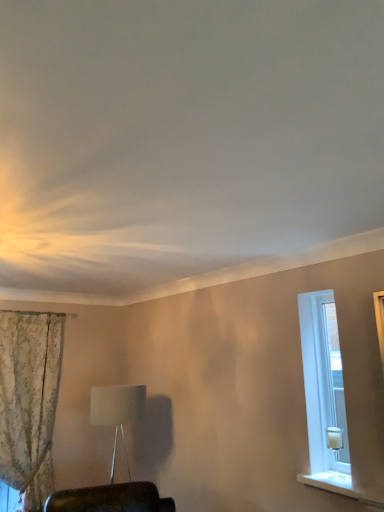
Identify the location of white fabric lampshade at center. (117, 412).

In the scene shown: Measure the distance between white smooth window sill at lower right and camera.

They are 1.97 meters apart.

The width and height of the screenshot is (384, 512). Describe the element at coordinates (343, 486) in the screenshot. I see `white smooth window sill at lower right` at that location.

What do you see at coordinates (324, 394) in the screenshot? I see `white glass candle at right` at bounding box center [324, 394].

Image resolution: width=384 pixels, height=512 pixels. I want to click on white fabric lampshade at center, so click(117, 412).

Is white smooth window sill at lower right aimed at floral fabric curtain at left?

No, white smooth window sill at lower right is not oriented towards floral fabric curtain at left.

The height and width of the screenshot is (512, 384). In order to click on curtain that appears behind the white smooth window sill at lower right in this screenshot , I will do `click(29, 400)`.

Between white smooth window sill at lower right and floral fabric curtain at left, which one is positioned behind?

floral fabric curtain at left is further away from the camera.

Would you say white smooth window sill at lower right is outside floral fabric curtain at left?

white smooth window sill at lower right is positioned outside floral fabric curtain at left.

From the picture: Is floral fabric curtain at left not within white fabric lampshade at center?

floral fabric curtain at left lies outside white fabric lampshade at center's area.

Does point (26, 345) come farther from viewer compared to point (120, 410)?

Yes, it is behind point (120, 410).

From their relative heights in the image, would you say floral fabric curtain at left is taller or shorter than white fabric lampshade at center?

Considering their sizes, floral fabric curtain at left has more height than white fabric lampshade at center.

From the image's perspective, relative to white glass candle at right, is floral fabric curtain at left above or below?

floral fabric curtain at left is situated lower than white glass candle at right in the image.

Measure the distance from floral fabric curtain at left to white glass candle at right.

They are 2.28 meters apart.

Is floral fabric curtain at left inside or outside of white glass candle at right?

The correct answer is: outside.

From the image's perspective, is white glass candle at right on top of white fabric lampshade at center?

Indeed, from the image's perspective, white glass candle at right is shown above white fabric lampshade at center.

Which is correct: white glass candle at right is inside white fabric lampshade at center, or outside of it?

white glass candle at right exists outside the volume of white fabric lampshade at center.

From the picture: Would you say white glass candle at right is to the left or to the right of white fabric lampshade at center in the picture?

In the image, white glass candle at right appears on the right side of white fabric lampshade at center.

Which is less distant, (306, 297) or (139, 390)?

Point (306, 297) appears to be closer to the viewer than point (139, 390).

How many degrees apart are the facing directions of white glass candle at right and floral fabric curtain at left?

90.1 degrees separate the facing orientations of white glass candle at right and floral fabric curtain at left.

Considering the relative sizes of white glass candle at right and floral fabric curtain at left in the image provided, is white glass candle at right wider than floral fabric curtain at left?

Incorrect, the width of white glass candle at right does not surpass that of floral fabric curtain at left.

Does point (350, 484) lie behind point (6, 425)?

No, (350, 484) is in front of (6, 425).

Is white fabric lampshade at center facing towards floral fabric curtain at left?

No, white fabric lampshade at center is not aimed at floral fabric curtain at left.

From a real-world perspective, is white fabric lampshade at center positioned over floral fabric curtain at left based on gravity?

No, from a real-world perspective, white fabric lampshade at center is not on top of floral fabric curtain at left.

From the image's perspective, is white fabric lampshade at center positioned above or below floral fabric curtain at left?

From the image's perspective, white fabric lampshade at center appears below floral fabric curtain at left.

Would you say white fabric lampshade at center is inside or outside floral fabric curtain at left?

white fabric lampshade at center is not inside floral fabric curtain at left, it's outside.

Between white glass candle at right and white smooth window sill at lower right, which one appears on the left side from the viewer's perspective?

Positioned to the left is white smooth window sill at lower right.

From a real-world perspective, which object stands above the other?

white glass candle at right.

Does point (317, 353) come behind point (381, 498)?

That is True.

Does white glass candle at right touch white smooth window sill at lower right?

No, white glass candle at right is not next to white smooth window sill at lower right.

In order to click on window sill in front of the floral fabric curtain at left in this screenshot , I will do `click(343, 486)`.

Image resolution: width=384 pixels, height=512 pixels. I want to click on table lamp lying on the right of floral fabric curtain at left, so click(117, 412).

Based on their spatial positions, is white fabric lampshade at center or floral fabric curtain at left closer to white smooth window sill at lower right?

Based on the image, white fabric lampshade at center appears to be nearer to white smooth window sill at lower right.

In the scene shown: Considering their positions, is white glass candle at right positioned further to white smooth window sill at lower right than white fabric lampshade at center?

white fabric lampshade at center is positioned further to the anchor white smooth window sill at lower right.

Looking at the image, which one is located closer to white fabric lampshade at center, white glass candle at right or floral fabric curtain at left?

floral fabric curtain at left lies closer to white fabric lampshade at center than the other object.

When comparing their distances from white glass candle at right, does floral fabric curtain at left or white fabric lampshade at center seem closer?

white fabric lampshade at center.

When comparing their distances from white fabric lampshade at center, does floral fabric curtain at left or white glass candle at right seem closer?

The object closer to white fabric lampshade at center is floral fabric curtain at left.

Looking at the image, which one is located closer to white glass candle at right, white smooth window sill at lower right or floral fabric curtain at left?

Based on the image, white smooth window sill at lower right appears to be nearer to white glass candle at right.

From the image, which object appears to be farther from floral fabric curtain at left, white glass candle at right or white fabric lampshade at center?

white glass candle at right lies further to floral fabric curtain at left than the other object.

When comparing their distances from white glass candle at right, does white fabric lampshade at center or white smooth window sill at lower right seem closer?

white smooth window sill at lower right is closer to white glass candle at right.

The height and width of the screenshot is (512, 384). Find the location of `window sill between white fabric lampshade at center and white glass candle at right in the horizontal direction`. window sill between white fabric lampshade at center and white glass candle at right in the horizontal direction is located at coordinates (343, 486).

Image resolution: width=384 pixels, height=512 pixels. What are the coordinates of `window sill situated between floral fabric curtain at left and white glass candle at right from left to right` in the screenshot? It's located at (343, 486).

The width and height of the screenshot is (384, 512). Identify the location of table lamp located between floral fabric curtain at left and white smooth window sill at lower right in the left-right direction. (117, 412).

This screenshot has width=384, height=512. I want to click on table lamp between floral fabric curtain at left and white glass candle at right from left to right, so click(117, 412).